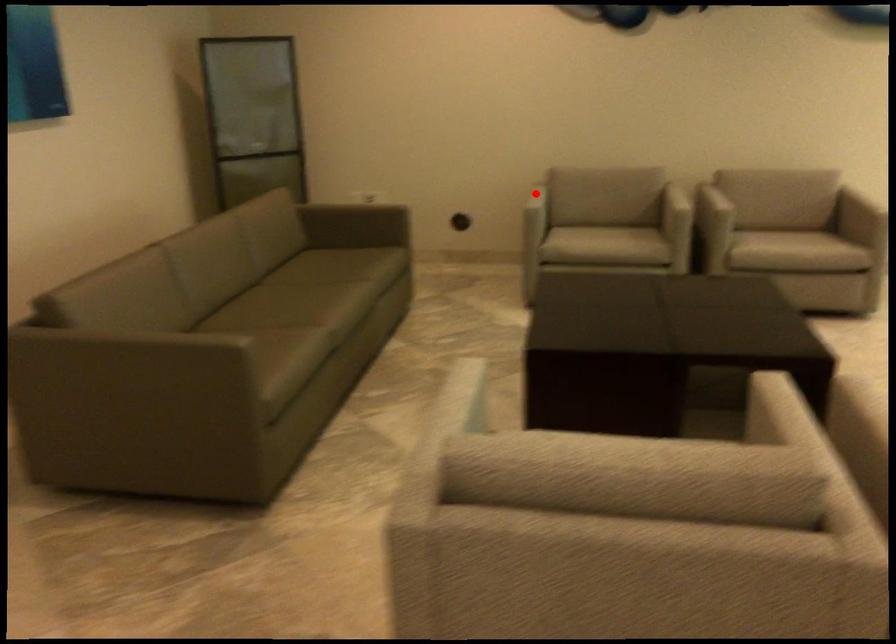
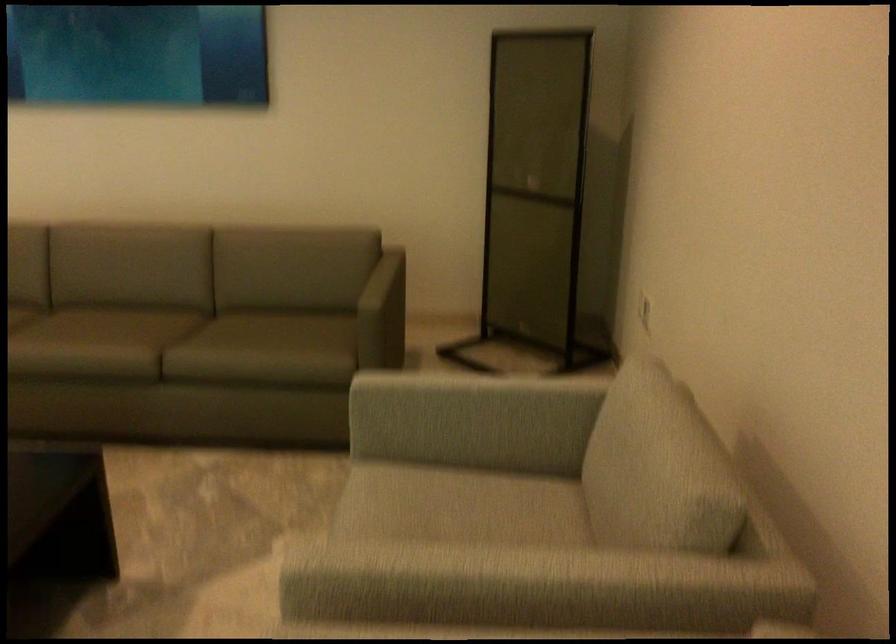
In the second image, find the point that corresponds to the highlighted location in the first image.

(469, 399)